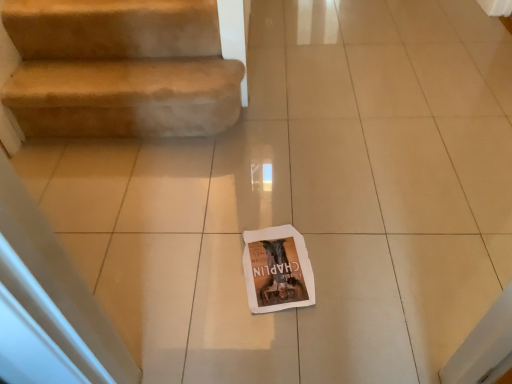
The image size is (512, 384). Find the location of `vacant region to the left of white paper at center`. vacant region to the left of white paper at center is located at coordinates (205, 286).